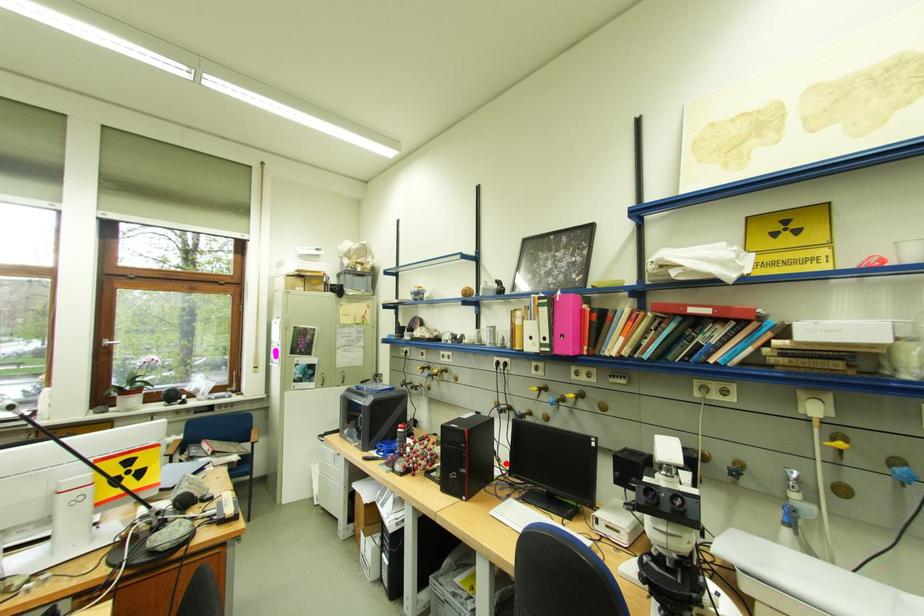
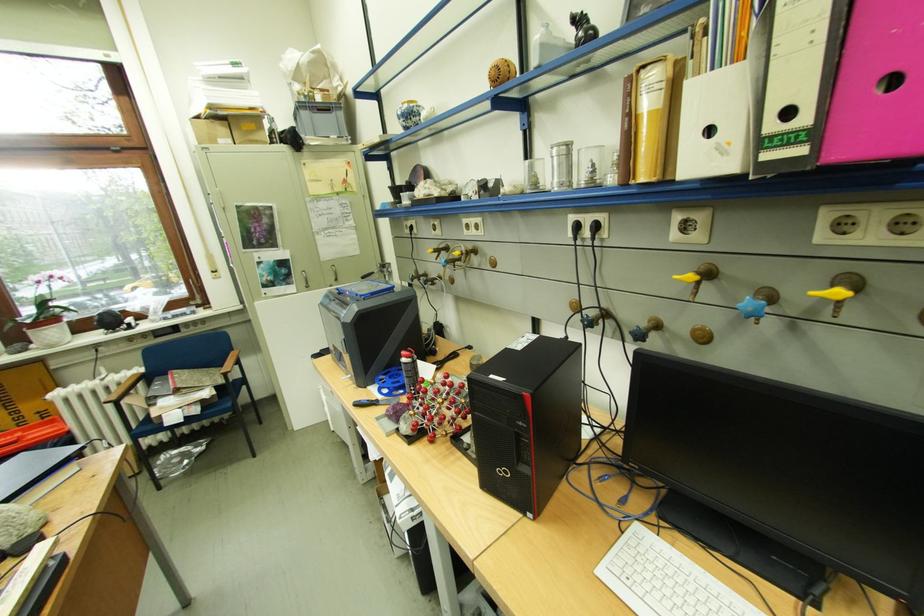
Find the pixel in the second image that matches the highlighted location in the first image.

(593, 421)